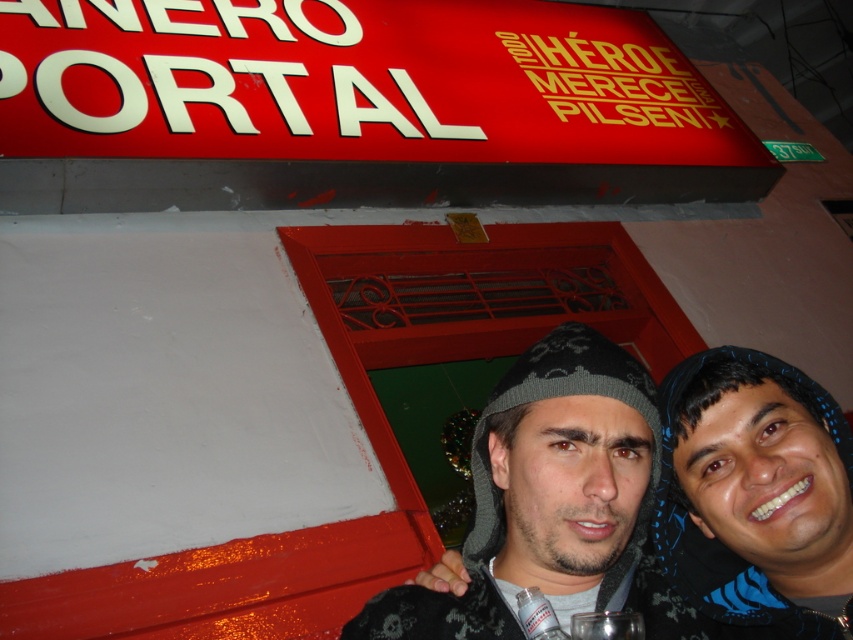
Can you confirm if dark gray knit cap at center is shorter than clear glass wine glass at center?

No.

Is dark gray knit cap at center closer to the viewer compared to clear glass wine glass at center?

No, dark gray knit cap at center is further to the viewer.

Is point (479, 468) farther from camera compared to point (624, 616)?

That is True.

You are a GUI agent. You are given a task and a screenshot of the screen. Output one action in this format:
    pyautogui.click(x=<x>, y=<y>)
    Task: Click on the dark gray knit cap at center
    
    Given the screenshot: What is the action you would take?
    pyautogui.click(x=548, y=500)

Is blue knit cap at center wider than clear glass wine glass at center?

Indeed, blue knit cap at center has a greater width compared to clear glass wine glass at center.

Does blue knit cap at center lie behind clear glass wine glass at center?

Yes, blue knit cap at center is behind clear glass wine glass at center.

You are a GUI agent. You are given a task and a screenshot of the screen. Output one action in this format:
    pyautogui.click(x=<x>, y=<y>)
    Task: Click on the blue knit cap at center
    
    Given the screenshot: What is the action you would take?
    pyautogui.click(x=755, y=497)

Locate an element on the screen. This screenshot has width=853, height=640. blue knit cap at center is located at coordinates (755, 497).

Who is more forward, (805, 528) or (577, 554)?

Point (805, 528) is in front.

Does point (749, 509) come behind point (575, 396)?

Yes.

Between point (732, 460) and point (637, 364), which one is positioned behind?

Positioned behind is point (637, 364).

The height and width of the screenshot is (640, 853). I want to click on blue knit cap at center, so click(755, 497).